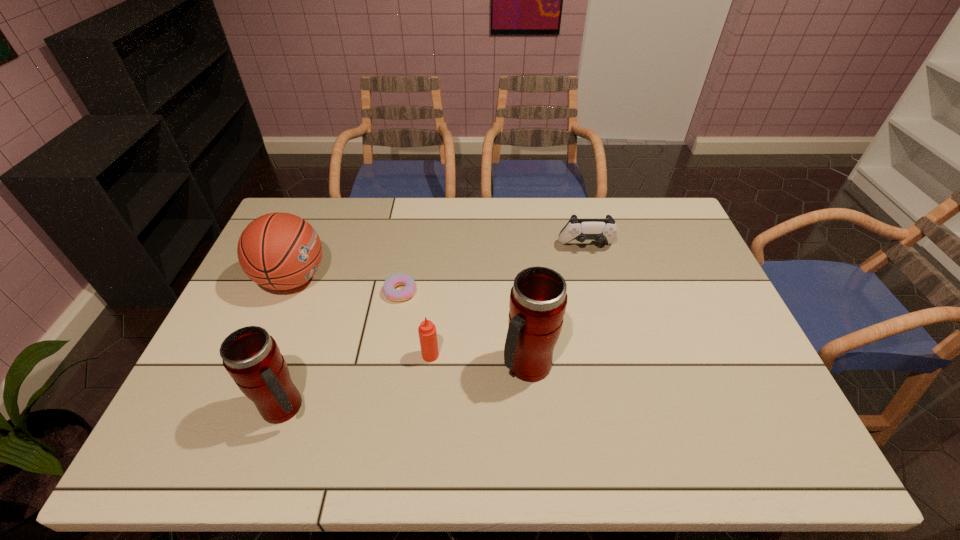
The width and height of the screenshot is (960, 540). I want to click on free space at the near left corner of the desktop, so click(x=207, y=387).

Image resolution: width=960 pixels, height=540 pixels. Identify the location of vacant space at the far right corner of the desktop. (674, 218).

The image size is (960, 540). What are the coordinates of `free spot between the taller thermos bottle and the doughnut` in the screenshot? It's located at (464, 329).

The width and height of the screenshot is (960, 540). Identify the location of free point between the left thermos bottle and the shortest object. (343, 349).

This screenshot has height=540, width=960. Identify the location of vacant area between the control and the basketball. (440, 263).

Locate an element on the screen. This screenshot has height=540, width=960. free space between the tallest object and the basketball is located at coordinates (410, 322).

You are a GUI agent. You are given a task and a screenshot of the screen. Output one action in this format:
    pyautogui.click(x=<x>, y=<y>)
    Task: Click on the free spot between the basketball and the fourth tallest object
    Image resolution: width=960 pixels, height=540 pixels.
    Given the screenshot: What is the action you would take?
    pyautogui.click(x=361, y=317)

The image size is (960, 540). I want to click on empty space that is in between the basketball and the fourth object from left to right, so click(x=361, y=317).

I want to click on vacant point located between the third object from right to left and the fourth object from right to left, so click(x=416, y=323).

The height and width of the screenshot is (540, 960). Identify the location of free space between the fourth object from right to left and the control. (493, 269).